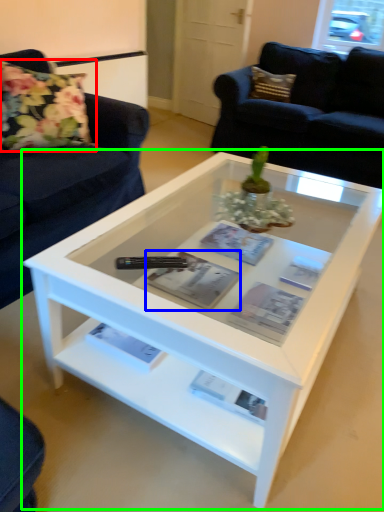
Question: Estimate the real-world distances between objects in this image. Which object is farther from flower (highlighted by a red box), magazine (highlighted by a blue box) or coffee table (highlighted by a green box)?

Choices:
 (A) magazine
 (B) coffee table

Answer: (A)